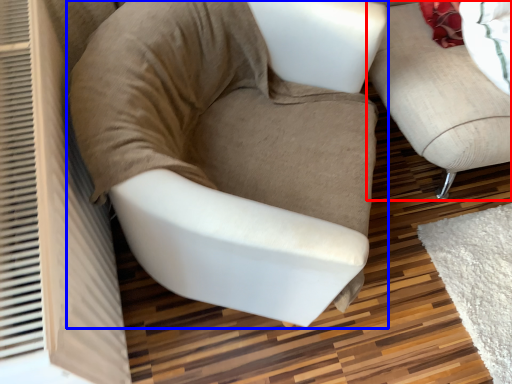
Question: Among these objects, which one is farthest to the camera, studio couch (highlighted by a red box) or chair (highlighted by a blue box)?

Choices:
 (A) studio couch
 (B) chair

Answer: (A)